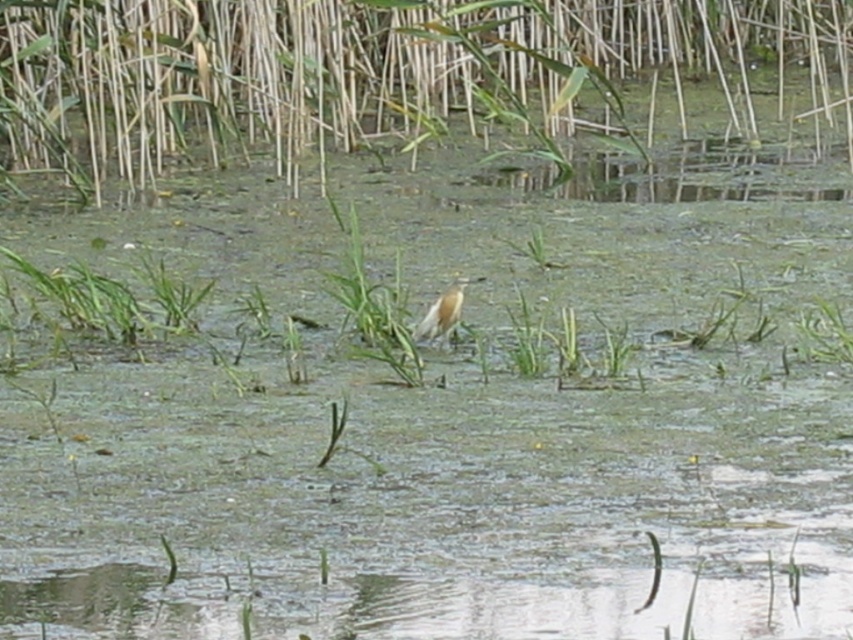
Which is in front, point (663, 61) or point (445, 342)?

Point (445, 342) is in front.

Who is taller, green grass at upper center or white matte bird at center?

With more height is green grass at upper center.

Image resolution: width=853 pixels, height=640 pixels. What are the coordinates of `green grass at upper center` in the screenshot? It's located at (374, 72).

The width and height of the screenshot is (853, 640). I want to click on green grass at upper center, so click(x=374, y=72).